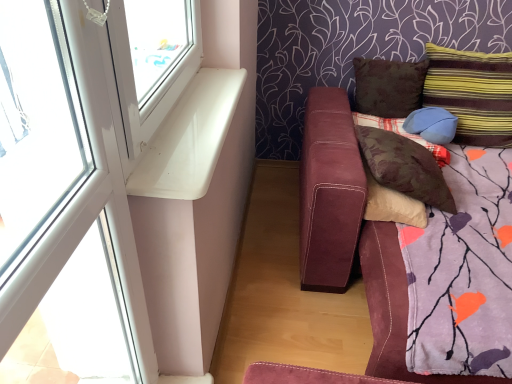
Question: Is suede-like maroon couch at lower right closer to the viewer compared to white glossy window sill at upper left?

Choices:
 (A) no
 (B) yes

Answer: (A)

Question: From the image's perspective, is suede-like maroon couch at lower right under white glossy window sill at upper left?

Choices:
 (A) no
 (B) yes

Answer: (B)

Question: Does suede-like maroon couch at lower right have a greater width compared to white glossy window sill at upper left?

Choices:
 (A) yes
 (B) no

Answer: (A)

Question: Could you tell me if suede-like maroon couch at lower right is turned towards white glossy window sill at upper left?

Choices:
 (A) no
 (B) yes

Answer: (A)

Question: From a real-world perspective, is suede-like maroon couch at lower right physically below white glossy window sill at upper left?

Choices:
 (A) yes
 (B) no

Answer: (A)

Question: Is suede-like maroon couch at lower right to the left of white glossy window sill at upper left from the viewer's perspective?

Choices:
 (A) no
 (B) yes

Answer: (A)

Question: Is the position of white plastic window at upper left less distant than that of white glossy window sill at upper left?

Choices:
 (A) yes
 (B) no

Answer: (A)

Question: Does white plastic window at upper left have a lesser height compared to white glossy window sill at upper left?

Choices:
 (A) no
 (B) yes

Answer: (A)

Question: From the image's perspective, is white plastic window at upper left on top of white glossy window sill at upper left?

Choices:
 (A) no
 (B) yes

Answer: (A)

Question: Does white plastic window at upper left appear on the left side of white glossy window sill at upper left?

Choices:
 (A) yes
 (B) no

Answer: (A)

Question: Is white plastic window at upper left outside of white glossy window sill at upper left?

Choices:
 (A) no
 (B) yes

Answer: (B)

Question: Can you confirm if white plastic window at upper left is wider than white glossy window sill at upper left?

Choices:
 (A) no
 (B) yes

Answer: (A)

Question: From a real-world perspective, is striped fabric pillow at upper right, which ranks as the 5th pillow in left-to-right order, beneath white plastic window at upper left?

Choices:
 (A) no
 (B) yes

Answer: (B)